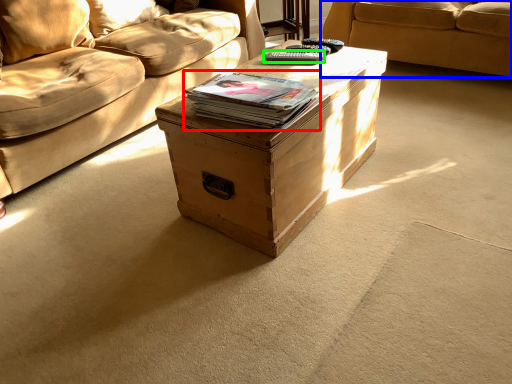
Question: Which is farther away from paperback book (highlighted by a red box)? studio couch (highlighted by a blue box) or remote (highlighted by a green box)?

Choices:
 (A) studio couch
 (B) remote

Answer: (A)